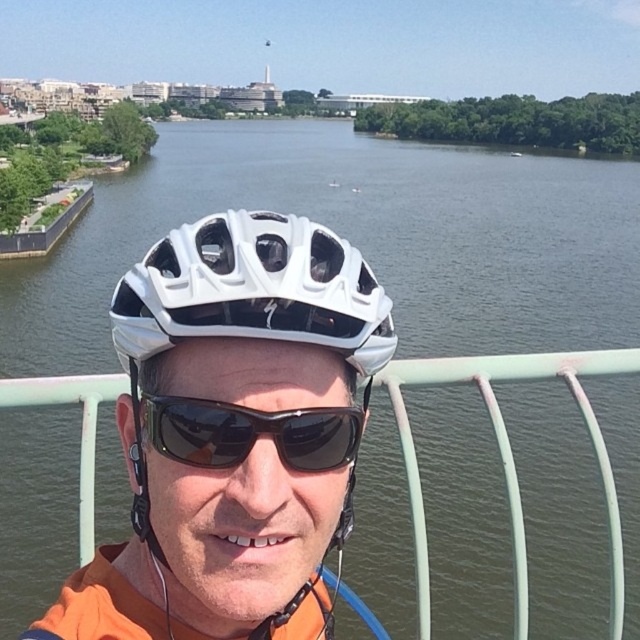
You are a photographer trying to capture a clear shot of the cityscape behind the person. You notice the white matte helmet at center and the white metal rail at center. Which object should you move your camera to the right to avoid blocking the city view?

To avoid blocking the city view, move your camera to the right to position it away from the white matte helmet at center, which is on the left side of the white metal rail at center.

You are a photographer trying to capture the cityscape in the background while ensuring the white matte helmet at center is visible in the foreground. Based on its position, where should you aim your camera to include both the helmet and the cityscape?

Since the white matte helmet at center is located at point (x=232, y=429), you should aim your camera slightly to the right and lower the angle slightly to ensure both the helmet and the cityscape in the background are visible in the frame.

You are a photographer trying to capture a clear shot of the city monument in the background. You notice the white matte helmet at center and the white metal rail at center might block your view. Which object is shorter and therefore less likely to obstruct your shot?

The white matte helmet at center is shorter than the white metal rail at center, so it is less likely to obstruct the view of the city monument in the background.